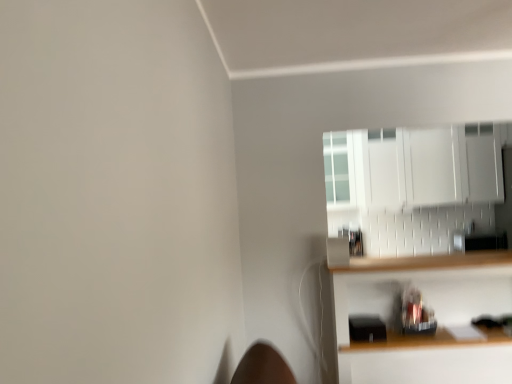
Question: From their relative heights in the image, would you say white glossy cabinet at upper right is taller or shorter than wooden shelf at lower right?

Choices:
 (A) tall
 (B) short

Answer: (B)

Question: From a real-world perspective, is white glossy cabinet at upper right positioned above or below wooden shelf at lower right?

Choices:
 (A) below
 (B) above

Answer: (B)

Question: Is point (398, 135) positioned closer to the camera than point (493, 370)?

Choices:
 (A) closer
 (B) farther

Answer: (B)

Question: Considering the positions of wooden shelf at lower right and white glossy cabinet at upper right in the image, is wooden shelf at lower right taller or shorter than white glossy cabinet at upper right?

Choices:
 (A) tall
 (B) short

Answer: (A)

Question: Do you think wooden shelf at lower right is within white glossy cabinet at upper right, or outside of it?

Choices:
 (A) outside
 (B) inside

Answer: (A)

Question: Is wooden shelf at lower right wider or thinner than white glossy cabinet at upper right?

Choices:
 (A) thin
 (B) wide

Answer: (B)

Question: Considering their positions, is wooden shelf at lower right located in front of or behind white glossy cabinet at upper right?

Choices:
 (A) front
 (B) behind

Answer: (A)